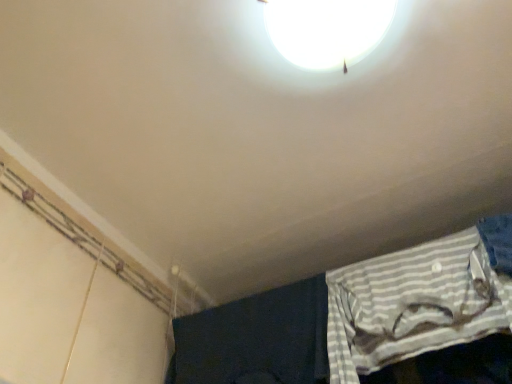
Question: Considering the positions of white glossy lamp at upper center and white striped fabric at lower right in the image, is white glossy lamp at upper center bigger or smaller than white striped fabric at lower right?

Choices:
 (A) small
 (B) big

Answer: (A)

Question: In terms of height, does white glossy lamp at upper center look taller or shorter compared to white striped fabric at lower right?

Choices:
 (A) tall
 (B) short

Answer: (B)

Question: From a real-world perspective, relative to white striped fabric at lower right, is white glossy lamp at upper center vertically above or below?

Choices:
 (A) below
 (B) above

Answer: (B)

Question: Choose the correct answer: Is white striped fabric at lower right inside white glossy lamp at upper center or outside it?

Choices:
 (A) outside
 (B) inside

Answer: (A)

Question: From a real-world perspective, is white striped fabric at lower right above or below white glossy lamp at upper center?

Choices:
 (A) above
 (B) below

Answer: (B)

Question: Relative to white glossy lamp at upper center, is white striped fabric at lower right in front or behind?

Choices:
 (A) front
 (B) behind

Answer: (B)

Question: Based on their positions, is white striped fabric at lower right located to the left or right of white glossy lamp at upper center?

Choices:
 (A) right
 (B) left

Answer: (A)